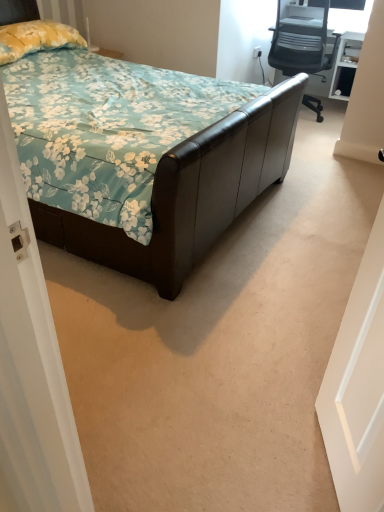
This screenshot has width=384, height=512. Find the location of `white plastic power outlet at upper right`. white plastic power outlet at upper right is located at coordinates (257, 52).

Image resolution: width=384 pixels, height=512 pixels. Describe the element at coordinates (257, 52) in the screenshot. I see `white plastic power outlet at upper right` at that location.

This screenshot has width=384, height=512. What do you see at coordinates (301, 40) in the screenshot?
I see `gray mesh office chair at upper right` at bounding box center [301, 40].

What is the approximate width of brown leather bed at center?

The width of brown leather bed at center is 2.26 meters.

Where is `white matte door at right`? The width and height of the screenshot is (384, 512). white matte door at right is located at coordinates (358, 387).

Considering the positions of points (343, 329) and (24, 25), is point (343, 329) farther from camera compared to point (24, 25)?

No, it is in front of (24, 25).

Which of these two, white matte door at right or yellow floral fabric pillow at upper left, is bigger?

Bigger between the two is yellow floral fabric pillow at upper left.

Is white matte door at right looking in the opposite direction of yellow floral fabric pillow at upper left?

white matte door at right does not have its back to yellow floral fabric pillow at upper left.

Would you say yellow floral fabric pillow at upper left is part of white matte door at right's contents?

No, yellow floral fabric pillow at upper left is located outside of white matte door at right.

From their relative heights in the image, would you say yellow floral fabric pillow at upper left is taller or shorter than white matte door at right?

In the image, yellow floral fabric pillow at upper left appears to be shorter than white matte door at right.

Which is less distant, (x=21, y=57) or (x=377, y=398)?

The point (x=377, y=398) is closer to the camera.

Is yellow floral fabric pillow at upper left next to white matte door at right and touching it?

No, yellow floral fabric pillow at upper left is not making contact with white matte door at right.

From a real-world perspective, is yellow floral fabric pillow at upper left above or below white matte door at right?

Clearly, from a real-world perspective, yellow floral fabric pillow at upper left is above white matte door at right.

Can you confirm if white matte door at right is bigger than brown leather bed at center?

No.

Which of these two, white matte door at right or brown leather bed at center, is thinner?

white matte door at right.

From a real-world perspective, who is located higher, white matte door at right or brown leather bed at center?

brown leather bed at center.

Are white matte door at right and brown leather bed at center far apart?

No, white matte door at right is not far away from brown leather bed at center.

Which object is positioned more to the right, brown leather bed at center or gray mesh office chair at upper right?

gray mesh office chair at upper right.

I want to click on bed above the gray mesh office chair at upper right (from a real-world perspective), so pyautogui.click(x=190, y=194).

From the image's perspective, who appears lower, brown leather bed at center or gray mesh office chair at upper right?

brown leather bed at center appears lower in the image.

Considering their positions, is brown leather bed at center located in front of or behind gray mesh office chair at upper right?

In the image, brown leather bed at center appears in front of gray mesh office chair at upper right.

Is point (104, 264) closer to camera compared to point (39, 42)?

Yes, it is.

From a real-world perspective, is brown leather bed at center positioned over yellow floral fabric pillow at upper left based on gravity?

No, from a real-world perspective, brown leather bed at center is not over yellow floral fabric pillow at upper left

Which of these two, brown leather bed at center or yellow floral fabric pillow at upper left, stands taller?

With more height is brown leather bed at center.

Considering the relative sizes of brown leather bed at center and yellow floral fabric pillow at upper left in the image provided, is brown leather bed at center smaller than yellow floral fabric pillow at upper left?

No.

In terms of width, does white plastic power outlet at upper right look wider or thinner when compared to gray mesh office chair at upper right?

In the image, white plastic power outlet at upper right appears to be more narrow than gray mesh office chair at upper right.

Can you see white plastic power outlet at upper right touching gray mesh office chair at upper right?

No.

From a real-world perspective, is white plastic power outlet at upper right above or below gray mesh office chair at upper right?

white plastic power outlet at upper right is below gray mesh office chair at upper right.

Between point (256, 54) and point (337, 45), which one is positioned in front?

The point (337, 45) is closer to the camera.

Does gray mesh office chair at upper right have a lesser height compared to white matte door at right?

Yes, gray mesh office chair at upper right is shorter than white matte door at right.

From a real-world perspective, is gray mesh office chair at upper right beneath white matte door at right?

Indeed, from a real-world perspective, gray mesh office chair at upper right is positioned beneath white matte door at right.

Is the depth of gray mesh office chair at upper right less than that of white matte door at right?

No, gray mesh office chair at upper right is further to the viewer.

Which is closer, (282, 66) or (363, 478)?

Point (282, 66) appears to be farther away from the viewer than point (363, 478).

Find the location of a particular element. This screenshot has height=512, width=384. pillow located behind the white matte door at right is located at coordinates (36, 39).

Find the location of a particular element. The height and width of the screenshot is (512, 384). door below the yellow floral fabric pillow at upper left (from a real-world perspective) is located at coordinates (358, 387).

Considering their positions, is brown leather bed at center positioned further to white matte door at right than yellow floral fabric pillow at upper left?

The object further to white matte door at right is yellow floral fabric pillow at upper left.

Looking at the image, which one is located closer to white plastic power outlet at upper right, yellow floral fabric pillow at upper left or gray mesh office chair at upper right?

gray mesh office chair at upper right lies closer to white plastic power outlet at upper right than the other object.

Which object lies further to the anchor point brown leather bed at center, white plastic power outlet at upper right or yellow floral fabric pillow at upper left?

white plastic power outlet at upper right lies further to brown leather bed at center than the other object.

Estimate the real-world distances between objects in this image. Which object is closer to white plastic power outlet at upper right, gray mesh office chair at upper right or white matte door at right?

gray mesh office chair at upper right is closer to white plastic power outlet at upper right.

Considering their positions, is white plastic power outlet at upper right positioned closer to white matte door at right than gray mesh office chair at upper right?

gray mesh office chair at upper right.

Estimate the real-world distances between objects in this image. Which object is closer to brown leather bed at center, white plastic power outlet at upper right or gray mesh office chair at upper right?

gray mesh office chair at upper right is closer to brown leather bed at center.

When comparing their distances from yellow floral fabric pillow at upper left, does white matte door at right or brown leather bed at center seem further?

white matte door at right.

From the image, which object appears to be farther from yellow floral fabric pillow at upper left, white plastic power outlet at upper right or gray mesh office chair at upper right?

white plastic power outlet at upper right lies further to yellow floral fabric pillow at upper left than the other object.

This screenshot has height=512, width=384. What are the coordinates of `bed between white matte door at right and yellow floral fabric pillow at upper left along the z-axis` in the screenshot? It's located at (190, 194).

You are a GUI agent. You are given a task and a screenshot of the screen. Output one action in this format:
    pyautogui.click(x=<x>, y=<y>)
    Task: Click on the pillow located between white matte door at right and white plastic power outlet at upper right in the depth direction
    
    Given the screenshot: What is the action you would take?
    pyautogui.click(x=36, y=39)

Where is `power outlet between yellow floral fabric pillow at upper left and gray mesh office chair at upper right from left to right`? power outlet between yellow floral fabric pillow at upper left and gray mesh office chair at upper right from left to right is located at coordinates (257, 52).

Identify the location of pillow between brown leather bed at center and white plastic power outlet at upper right along the z-axis. The width and height of the screenshot is (384, 512). (36, 39).